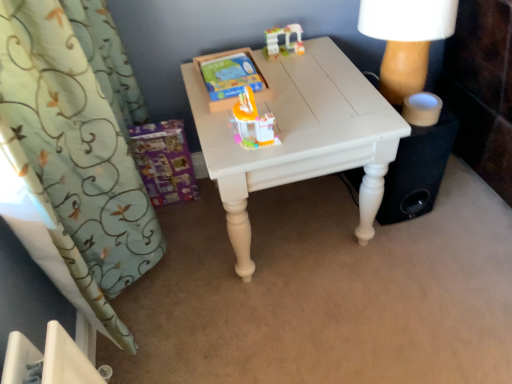
Question: From a real-world perspective, is green floral fabric curtain at left above or below translucent plastic toy at center, the second toy when ordered from back to front?

Choices:
 (A) above
 (B) below

Answer: (B)

Question: Relative to translucent plastic toy at center, which is the 1th toy from bottom to top, is green floral fabric curtain at left in front or behind?

Choices:
 (A) behind
 (B) front

Answer: (B)

Question: Which object is the closest to the translucent plastic building at upper center, which is counted as the 2th toy, starting from the bottom?

Choices:
 (A) white painted wood table at center
 (B) translucent plastic toy at center, arranged as the first toy when viewed from the front
 (C) green floral fabric curtain at left

Answer: (A)

Question: Estimate the real-world distances between objects in this image. Which object is closer to the white painted wood table at center?

Choices:
 (A) translucent plastic building at upper center, marked as the 2th toy in a front-to-back arrangement
 (B) green floral fabric curtain at left
 (C) translucent plastic toy at center, acting as the second toy starting from the top

Answer: (C)